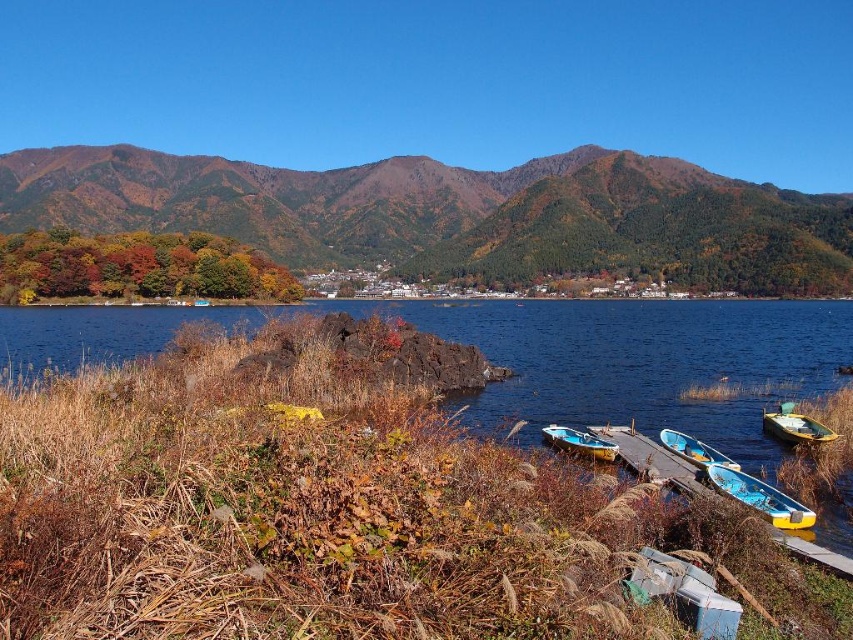
You are standing on the lakeside and want to locate two specific points marked in the image. The first point is at coordinates point (778, 429), and the second is at point (664, 442). From your vantage point, which of these two points is positioned farther away from you?

Point (778, 429) is behind point (664, 442), so it is farther away from you.